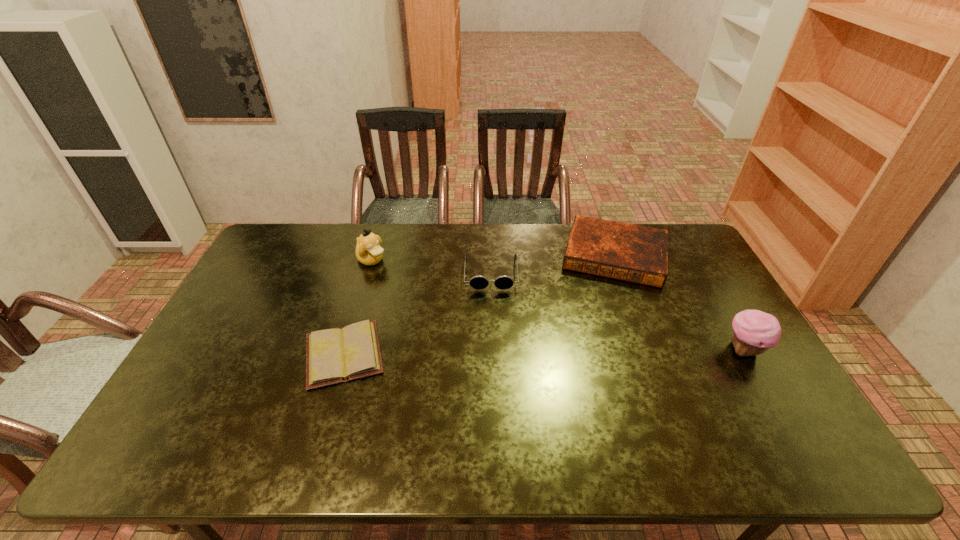
At what (x,y) coordinates should I click in order to perform the action: click on cupcake located at the right edge. Please return your answer as a coordinate pair (x, y). Looking at the image, I should click on (754, 332).

Image resolution: width=960 pixels, height=540 pixels. I want to click on Bible at the right edge, so click(x=639, y=254).

Image resolution: width=960 pixels, height=540 pixels. Find the location of `object at the far right corner`. object at the far right corner is located at coordinates (639, 254).

This screenshot has width=960, height=540. Find the location of `vacant position at the far edge of the desktop`. vacant position at the far edge of the desktop is located at coordinates (453, 256).

Where is `vacant space at the near edge`? The width and height of the screenshot is (960, 540). vacant space at the near edge is located at coordinates (627, 419).

Identify the location of vacant space at the left edge. This screenshot has height=540, width=960. (265, 292).

Identify the location of free space between the duckling and the cupcake. (558, 305).

At what (x,y) coordinates should I click in order to perform the action: click on free space that is in between the second object from right to left and the third object from right to left. Please return your answer as a coordinate pair (x, y). The image size is (960, 540). Looking at the image, I should click on (553, 264).

Where is `blank region between the Bible and the third object from left to right`? blank region between the Bible and the third object from left to right is located at coordinates (553, 264).

Find the location of `vacant area that lies between the duckling and the third object from right to left`. vacant area that lies between the duckling and the third object from right to left is located at coordinates (431, 266).